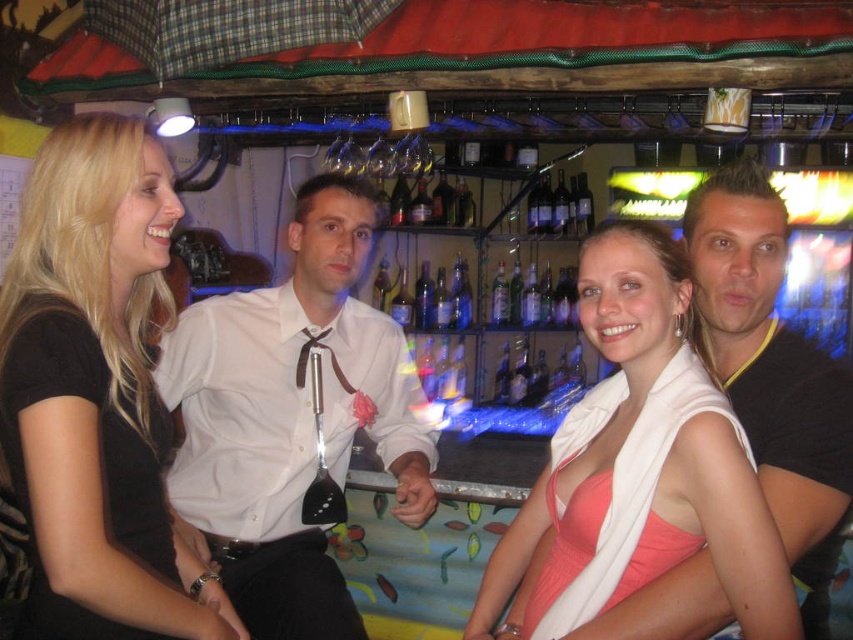
You are standing at the entrance of the bar and want to locate the white satin shirt at center. According to the coordinates provided, where should you look?

The white satin shirt at center is located at point 0.655 on the x axis and 0.341 on the y axis.